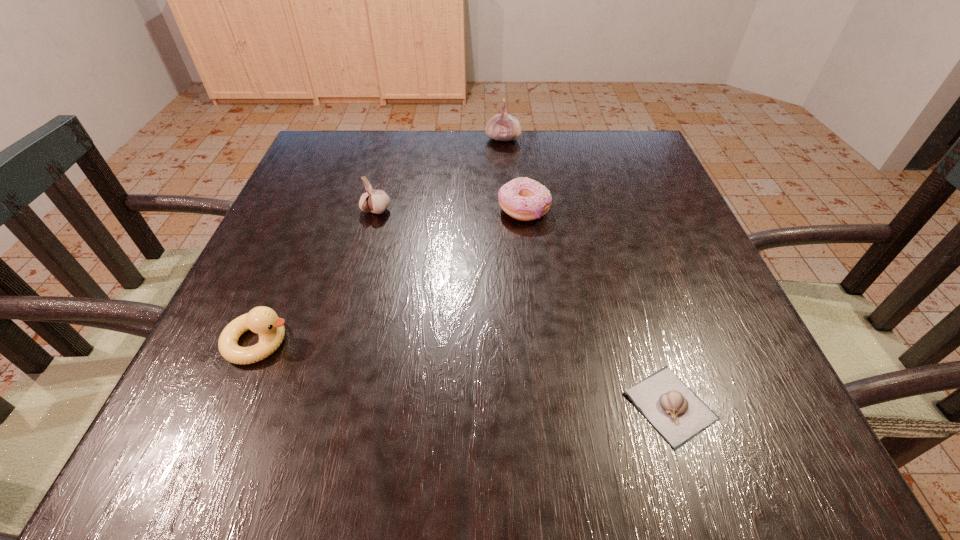
Identify the location of free space located at the beak of the duckling. This screenshot has height=540, width=960. (526, 342).

The width and height of the screenshot is (960, 540). In order to click on vacant region located 0.250m on the left of the doughnut in this screenshot , I will do `click(384, 210)`.

You are a GUI agent. You are given a task and a screenshot of the screen. Output one action in this format:
    pyautogui.click(x=<x>, y=<y>)
    Task: Click on the free location located on the left of the rightmost garlic
    The height and width of the screenshot is (540, 960).
    Given the screenshot: What is the action you would take?
    pyautogui.click(x=442, y=406)

This screenshot has width=960, height=540. What are the coordinates of `object that is at the far edge` in the screenshot? It's located at (503, 127).

This screenshot has height=540, width=960. In order to click on object that is at the near edge in this screenshot , I will do `click(676, 412)`.

Image resolution: width=960 pixels, height=540 pixels. Find the location of `object that is at the left edge`. object that is at the left edge is located at coordinates (262, 320).

The height and width of the screenshot is (540, 960). I want to click on object that is at the right edge, so click(x=676, y=412).

At what (x,y) coordinates should I click in order to perform the action: click on object present at the near right corner. Please return your answer as a coordinate pair (x, y). Looking at the image, I should click on (676, 412).

The width and height of the screenshot is (960, 540). Identify the location of vacant space at the far edge of the desktop. (524, 147).

I want to click on free region at the near edge, so click(x=566, y=417).